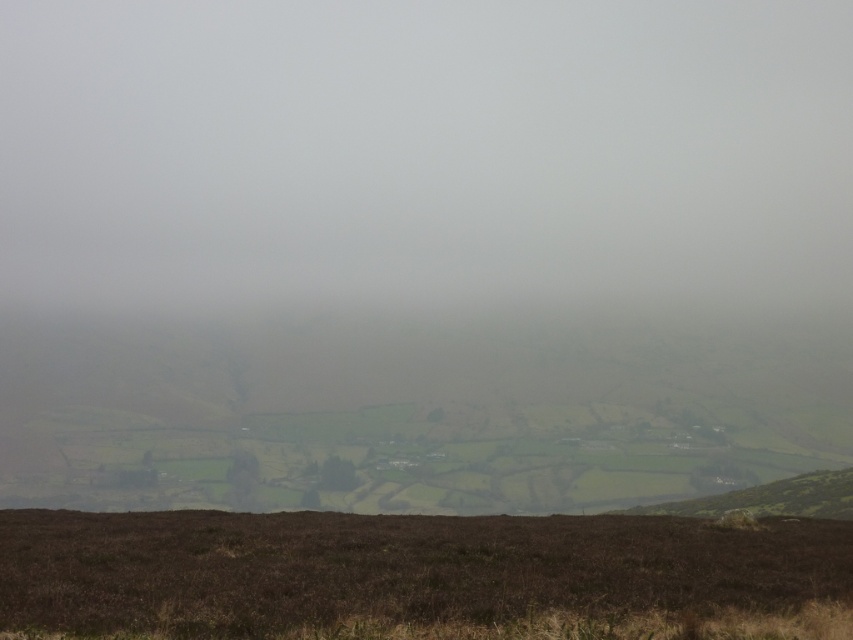
Question: Which point is closer to the camera?

Choices:
 (A) white matte fog at center
 (B) brown rough grass at bottom

Answer: (B)

Question: Is white matte fog at center behind brown rough grass at bottom?

Choices:
 (A) yes
 (B) no

Answer: (A)

Question: Is white matte fog at center to the left of brown rough grass at bottom from the viewer's perspective?

Choices:
 (A) yes
 (B) no

Answer: (A)

Question: Among these objects, which one is farthest from the camera?

Choices:
 (A) white matte fog at center
 (B) brown rough grass at bottom

Answer: (A)

Question: In this image, where is white matte fog at center located relative to brown rough grass at bottom?

Choices:
 (A) above
 (B) below

Answer: (A)